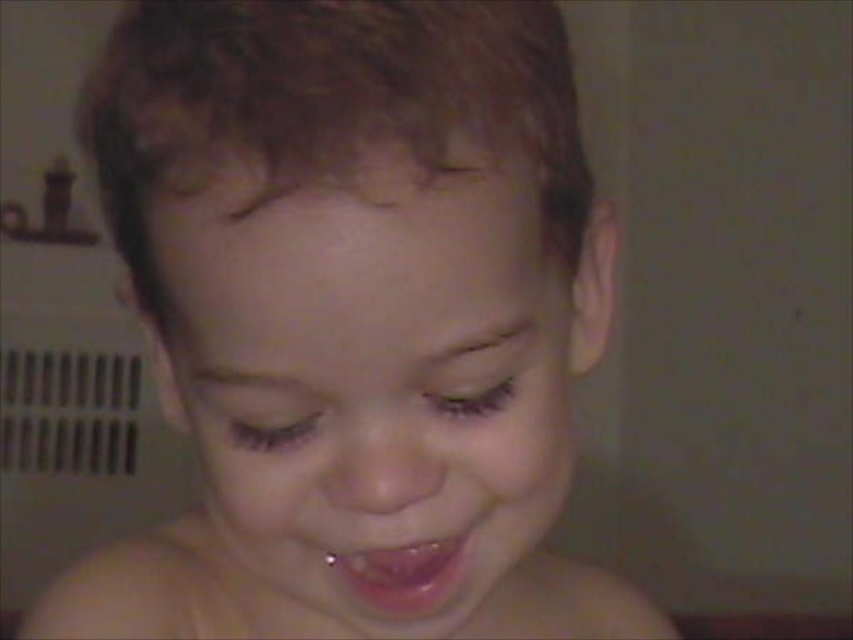
Is pink glossy lips at center smaller than metallic gold toy at upper left?

Correct, pink glossy lips at center occupies less space than metallic gold toy at upper left.

Can you confirm if pink glossy lips at center is positioned below metallic gold toy at upper left?

Yes, pink glossy lips at center is below metallic gold toy at upper left.

This screenshot has width=853, height=640. Identify the location of pink glossy lips at center. (403, 573).

Where is `pink glossy lips at center`? The width and height of the screenshot is (853, 640). pink glossy lips at center is located at coordinates (403, 573).